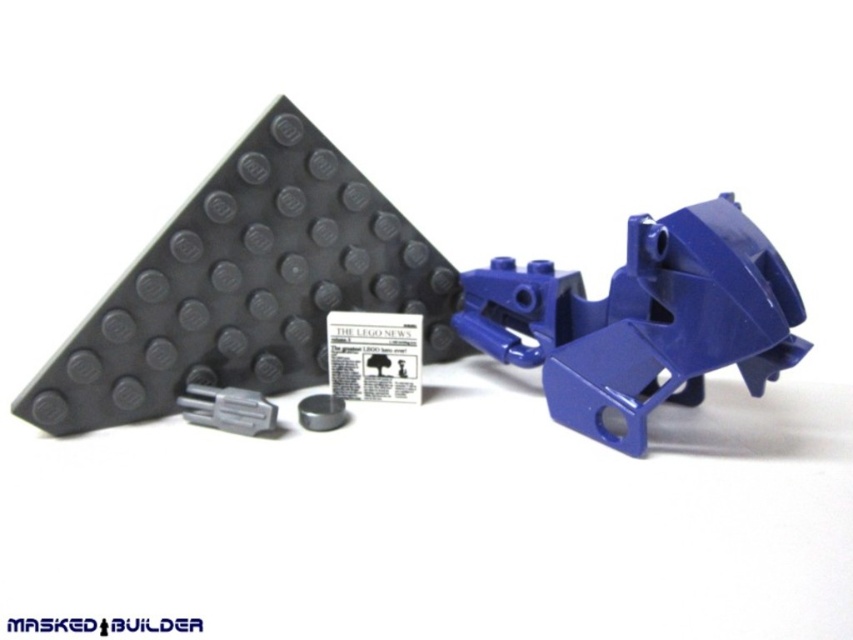
Who is lower down, matte blue plastic motorcycle at center-right or gray matte plastic connector at lower left?

Positioned lower is gray matte plastic connector at lower left.

In order to click on matte blue plastic motorcycle at center-right in this screenshot , I will do `click(409, 300)`.

Where is `matte blue plastic motorcycle at center-right`? This screenshot has height=640, width=853. matte blue plastic motorcycle at center-right is located at coordinates (409, 300).

Does point (392, 225) come farther from viewer compared to point (605, 346)?

Yes, it is.

Between point (492, 294) and point (643, 422), which one is positioned behind?

The point (492, 294) is more distant.

Is point (747, 314) positioned behind point (485, 352)?

That is False.

This screenshot has width=853, height=640. Identify the location of matte blue plastic motorcycle at center-right. (409, 300).

Does glossy plastic motorcycle at right have a lesser width compared to gray matte plastic connector at lower left?

In fact, glossy plastic motorcycle at right might be wider than gray matte plastic connector at lower left.

Between glossy plastic motorcycle at right and gray matte plastic connector at lower left, which one has more height?

glossy plastic motorcycle at right is taller.

Find the location of a particular element. glossy plastic motorcycle at right is located at coordinates pyautogui.click(x=643, y=320).

Find the location of a particular element. The image size is (853, 640). glossy plastic motorcycle at right is located at coordinates (643, 320).